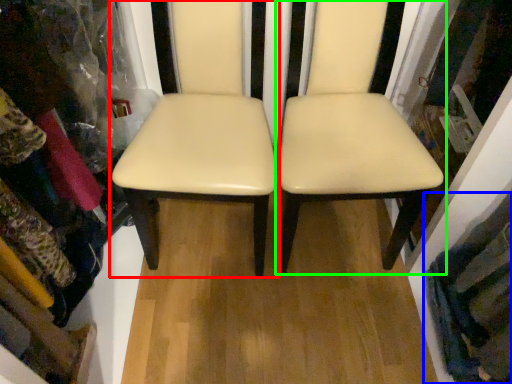
Question: Which object is positioned farthest from chair (highlighted by a red box)? Select from clothing (highlighted by a blue box) and chair (highlighted by a green box).

Choices:
 (A) clothing
 (B) chair

Answer: (A)